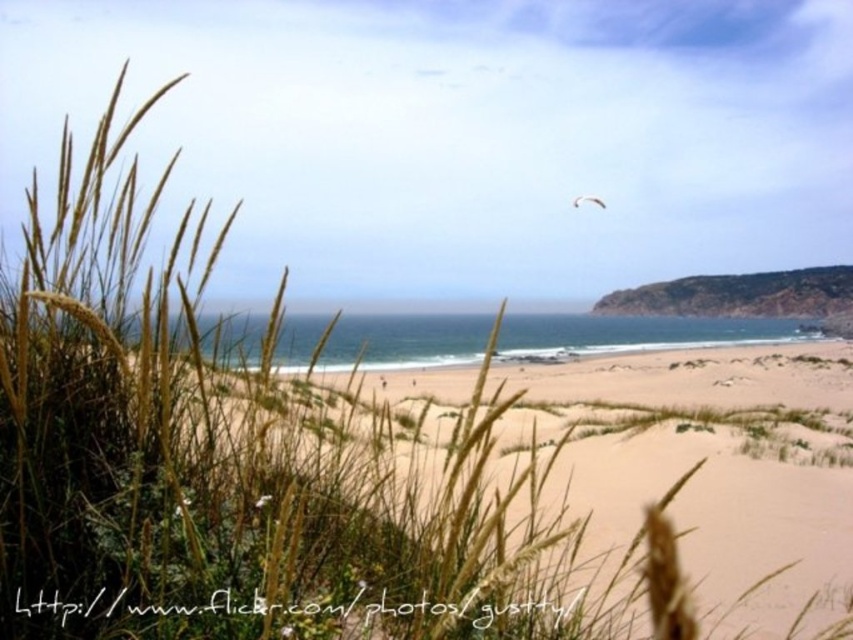
Is light brown sandy beach at center to the left of brown rocky cliff at upper right from the viewer's perspective?

Correct, you'll find light brown sandy beach at center to the left of brown rocky cliff at upper right.

Which of these two, light brown sandy beach at center or brown rocky cliff at upper right, stands taller?

With more height is brown rocky cliff at upper right.

Where is `light brown sandy beach at center`? This screenshot has width=853, height=640. light brown sandy beach at center is located at coordinates (498, 499).

This screenshot has height=640, width=853. I want to click on light brown sandy beach at center, so click(x=498, y=499).

Which is behind, point (827, 289) or point (577, 202)?

Point (827, 289)

Can you confirm if brown rocky cliff at upper right is positioned to the left of white feathered bird at upper center?

Incorrect, brown rocky cliff at upper right is not on the left side of white feathered bird at upper center.

Is point (705, 305) closer to viewer compared to point (601, 198)?

No, (705, 305) is further to viewer.

Locate an element on the screen. Image resolution: width=853 pixels, height=640 pixels. brown rocky cliff at upper right is located at coordinates (740, 294).

Between point (828, 381) and point (573, 204), which one is positioned behind?

The point (573, 204) is more distant.

Is point (248, 554) positioned after point (576, 196)?

That is False.

This screenshot has height=640, width=853. I want to click on light brown sandy beach at center, so click(x=498, y=499).